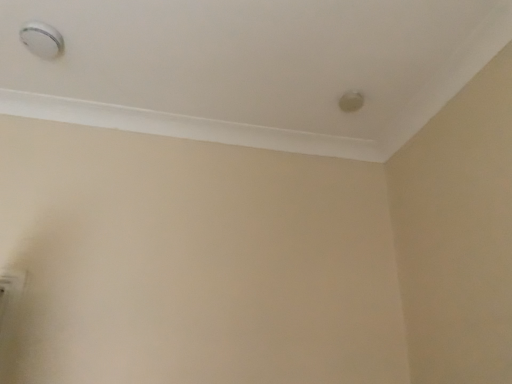
Question: Does matte white knob at upper right, which ranks as the first knob in right-to-left order, have a greater width compared to white plastic smoke detector at upper left, the second knob positioned from the bottom?

Choices:
 (A) yes
 (B) no

Answer: (B)

Question: Can you confirm if matte white knob at upper right, which ranks as the first knob in right-to-left order, is shorter than white plastic smoke detector at upper left, placed as the 1th knob when sorted from left to right?

Choices:
 (A) no
 (B) yes

Answer: (B)

Question: From the image's perspective, is matte white knob at upper right, arranged as the second knob when viewed from the left, located beneath white plastic smoke detector at upper left, the first knob viewed from the top?

Choices:
 (A) no
 (B) yes

Answer: (B)

Question: Is matte white knob at upper right, arranged as the second knob when viewed from the left, closer to the viewer compared to white plastic smoke detector at upper left, acting as the 2th knob starting from the right?

Choices:
 (A) no
 (B) yes

Answer: (A)

Question: Could white plastic smoke detector at upper left, the first knob viewed from the top, be considered to be inside matte white knob at upper right, which ranks as the first knob in right-to-left order?

Choices:
 (A) yes
 (B) no

Answer: (B)

Question: Can you confirm if matte white knob at upper right, the 1th knob viewed from the back, is bigger than white plastic smoke detector at upper left, the first knob viewed from the top?

Choices:
 (A) no
 (B) yes

Answer: (A)

Question: Does white plastic smoke detector at upper left, the second knob positioned from the bottom, have a lesser height compared to matte white knob at upper right, positioned as the second knob in top-to-bottom order?

Choices:
 (A) yes
 (B) no

Answer: (B)

Question: From a real-world perspective, is white plastic smoke detector at upper left, the second knob positioned from the bottom, over matte white knob at upper right, which ranks as the first knob in right-to-left order?

Choices:
 (A) yes
 (B) no

Answer: (B)

Question: From the image's perspective, is white plastic smoke detector at upper left, the second knob positioned from the bottom, on top of matte white knob at upper right, which ranks as the first knob in right-to-left order?

Choices:
 (A) yes
 (B) no

Answer: (A)

Question: Can you confirm if white plastic smoke detector at upper left, placed as the 1th knob when sorted from left to right, is taller than matte white knob at upper right, which is counted as the 2th knob, starting from the front?

Choices:
 (A) yes
 (B) no

Answer: (A)

Question: From the image's perspective, does white plastic smoke detector at upper left, placed as the 1th knob when sorted from left to right, appear lower than matte white knob at upper right, arranged as the second knob when viewed from the left?

Choices:
 (A) no
 (B) yes

Answer: (A)

Question: Is matte white knob at upper right, arranged as the second knob when viewed from the left, completely or partially inside white plastic smoke detector at upper left, placed as the 1th knob when sorted from front to back?

Choices:
 (A) yes
 (B) no

Answer: (B)

Question: From a real-world perspective, is matte white knob at upper right, which ranks as the first knob in right-to-left order, above or below white plastic smoke detector at upper left, placed as the 1th knob when sorted from left to right?

Choices:
 (A) below
 (B) above

Answer: (B)